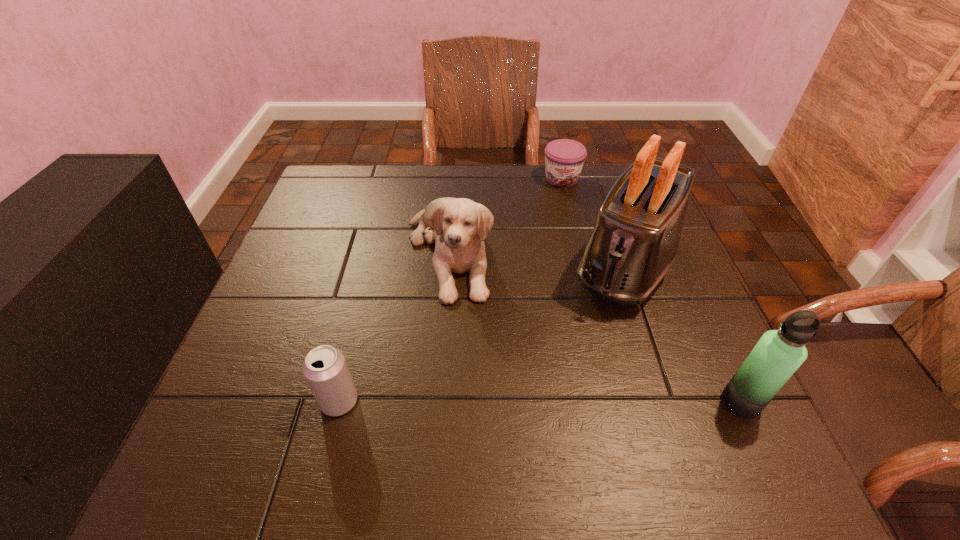
In order to click on free space between the beer can and the toaster in this screenshot , I will do `click(483, 333)`.

Where is `unoccupied area between the beer can and the third tallest object`? Image resolution: width=960 pixels, height=540 pixels. unoccupied area between the beer can and the third tallest object is located at coordinates (x=394, y=327).

Locate an element on the screen. The height and width of the screenshot is (540, 960). object identified as the second closest to the shortest object is located at coordinates (460, 226).

Locate which object is the fourth closest to the toaster. Please provide its 2D coordinates. Your answer should be formatted as a tuple, i.e. [(x, y)], where the tuple contains the x and y coordinates of a point satisfying the conditions above.

[(325, 369)]

The height and width of the screenshot is (540, 960). What are the coordinates of `vacant space that satisfies the following two spatial constraints: 1. on the front side of the toaster; 2. on the right side of the thermos bottle` in the screenshot? It's located at (672, 401).

The width and height of the screenshot is (960, 540). What are the coordinates of `free space that satisfies the following two spatial constraints: 1. on the back side of the farthest object; 2. on the left side of the third shortest object` in the screenshot? It's located at (454, 179).